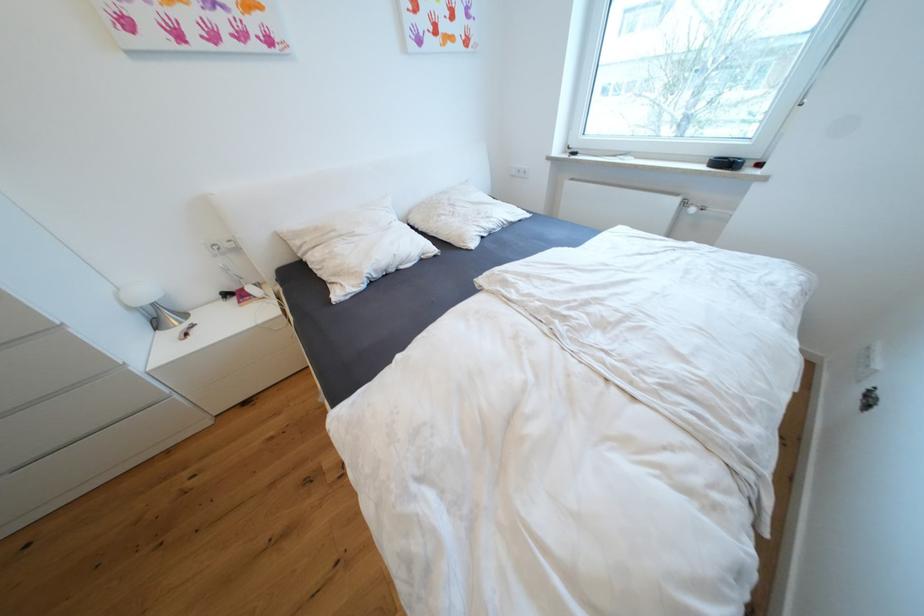
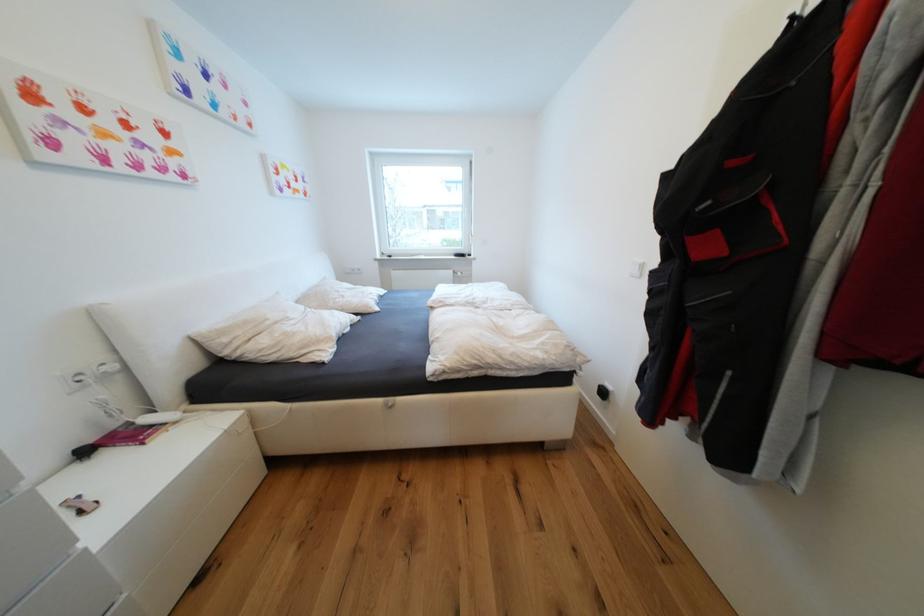
In the second image, find the point that corresponds to [222,246] in the first image.

(87, 376)